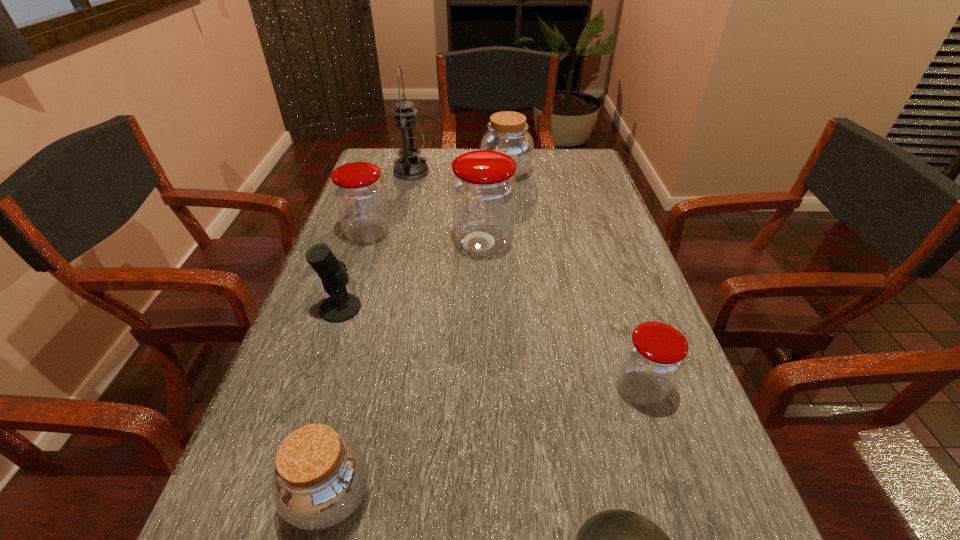
Where is `object that is the fourth nearest to the tallest object`? This screenshot has height=540, width=960. object that is the fourth nearest to the tallest object is located at coordinates (341, 306).

At what (x,y) coordinates should I click in order to perform the action: click on jar object that ranks as the fourth closest to the bowl. Please return your answer as a coordinate pair (x, y). Looking at the image, I should click on (359, 193).

Find the location of `jar that is the fourth closest one to the farther brown jar`. jar that is the fourth closest one to the farther brown jar is located at coordinates (320, 477).

Identify the location of red jar that is the second nearest to the farther brown jar. pyautogui.click(x=359, y=193).

This screenshot has width=960, height=540. What are the coordinates of `the third closest red jar relative to the gray oil lamp` in the screenshot? It's located at (654, 357).